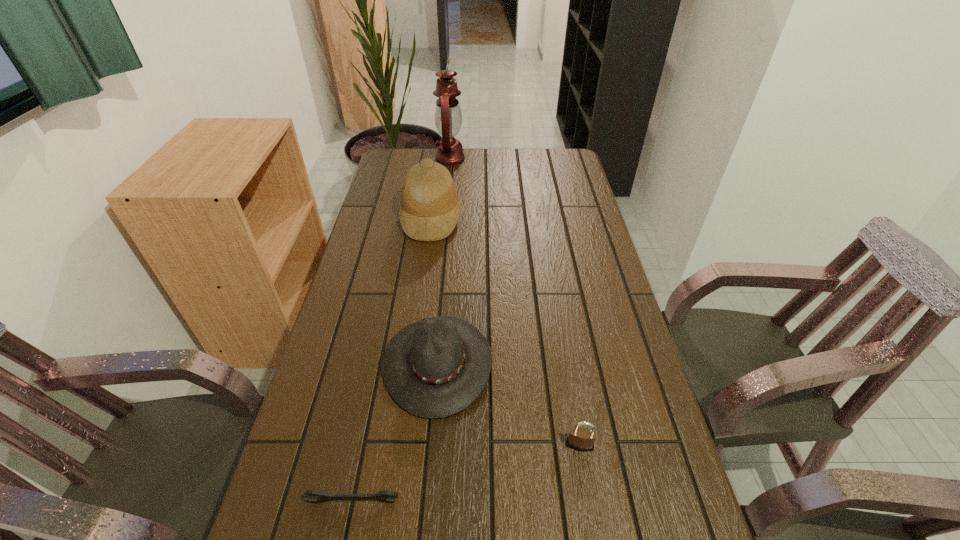
I want to click on vacant space at the right edge of the desktop, so click(x=615, y=288).

This screenshot has width=960, height=540. I want to click on free space at the far left corner of the desktop, so click(412, 167).

The height and width of the screenshot is (540, 960). Identify the location of free area in between the tallest object and the second nearest object. (515, 302).

Where is `vacant area between the taller hat and the second nearest object`? This screenshot has height=540, width=960. vacant area between the taller hat and the second nearest object is located at coordinates (505, 332).

The image size is (960, 540). Find the location of `free space that is in between the nearer hat and the second farthest object`. free space that is in between the nearer hat and the second farthest object is located at coordinates (435, 291).

Locate an element on the screen. blank region between the padlock and the third nearest object is located at coordinates click(509, 404).

Where is `free space between the fourth farthest object and the nearest object`? free space between the fourth farthest object and the nearest object is located at coordinates (467, 473).

Identify the location of object that is the second closest to the fourth shortest object. Image resolution: width=960 pixels, height=540 pixels. (434, 368).

Point out which object is positioned as the second nearest to the third nearest object. Please provide its 2D coordinates. Your answer should be formatted as a tuple, i.e. [(x, y)], where the tuple contains the x and y coordinates of a point satisfying the conditions above.

[(386, 496)]

Find the location of `vacant space that satisfies the following two spatial constraints: 1. on the front-facing side of the second nearest object; 2. on the right side of the second tallest object`. vacant space that satisfies the following two spatial constraints: 1. on the front-facing side of the second nearest object; 2. on the right side of the second tallest object is located at coordinates (399, 445).